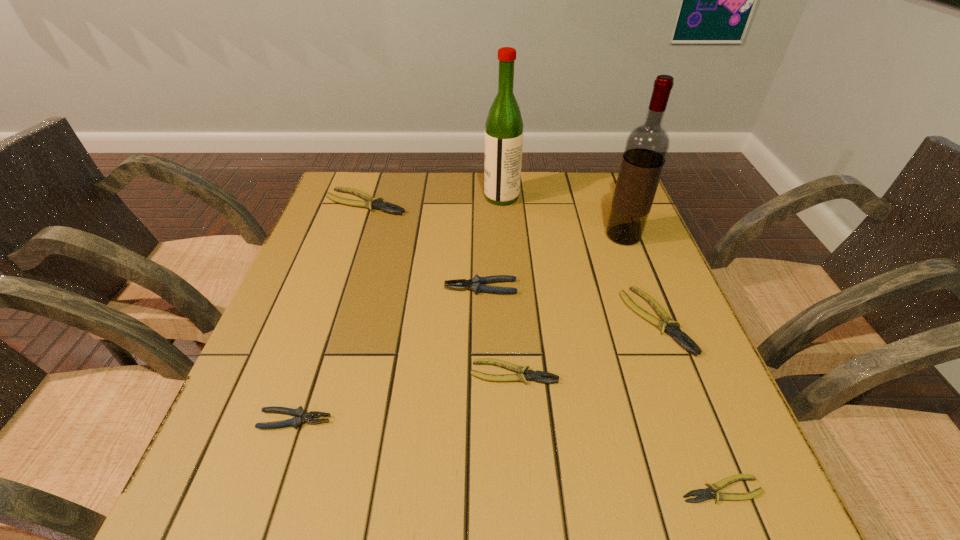
You are a GUI agent. You are given a task and a screenshot of the screen. Output one action in this format:
    pyautogui.click(x=<x>, y=<y>)
    Task: Click on the free space located on the right of the farthest pliers
    The image size is (960, 540).
    Given the screenshot: What is the action you would take?
    pyautogui.click(x=428, y=202)

This screenshot has width=960, height=540. Identify the location of vacant space located on the left of the third nearest yellow pliers. click(604, 321).

Locate an element on the screen. This screenshot has height=540, width=960. vacant space located at the gripping part of the nearer gray pliers is located at coordinates (449, 420).

Locate an element on the screen. This screenshot has width=960, height=540. free space located 0.210m on the left of the third farthest yellow pliers is located at coordinates (362, 373).

You are a GUI agent. You are given a task and a screenshot of the screen. Output one action in this format:
    pyautogui.click(x=<x>, y=<y>)
    Task: Click on the free space located on the left of the nearest object
    The height and width of the screenshot is (540, 960).
    Given the screenshot: What is the action you would take?
    pyautogui.click(x=484, y=490)

Find the location of a particular element. liquor present at the far edge is located at coordinates (504, 127).

The image size is (960, 540). In order to click on pliers situated at the far edge in this screenshot , I will do `click(371, 202)`.

Locate an element on the screen. The height and width of the screenshot is (540, 960). object positioned at the near edge is located at coordinates (705, 494).

At what (x,y) coordinates should I click in order to perform the action: click on wine bottle positioned at the right edge. Please return your answer as a coordinate pair (x, y). Looking at the image, I should click on (646, 148).

The width and height of the screenshot is (960, 540). I want to click on object present at the far left corner, so click(x=371, y=202).